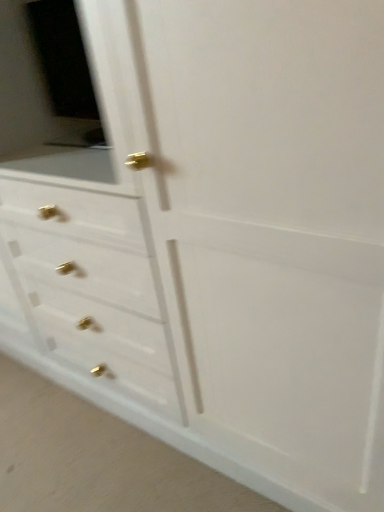
Question: Should I look upward or downward to see matte white medicine cabinet at upper left?

Choices:
 (A) up
 (B) down

Answer: (A)